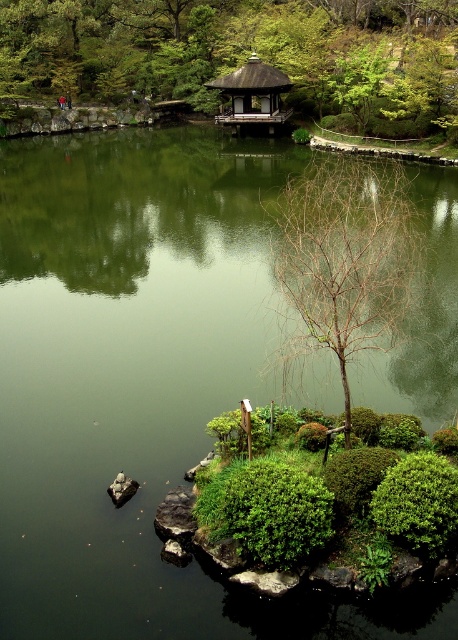
You are a gardener planning to plant a new tree in the Japanese garden. You notice the bare branches at center and the smooth gray rock at lower left. Which object is taller, and how might this affect your planting decision?

The bare branches at center is taller than the smooth gray rock at lower left. When planting a new tree, you should consider the height of the existing bare branches to maintain visual balance and ensure the new tree doesn not overshadow or clash with the existing elements in the garden.

You are a visitor in the garden and want to take a photo of both the green leafy tree at upper center and the shiny dark brown gazebo at upper center. Can you frame both in the same shot without moving your position?

Yes, you can frame both the green leafy tree at upper center and the shiny dark brown gazebo at upper center in the same shot because the green leafy tree at upper center is positioned above the gazebo, allowing both to be captured within the camera frame.

You are a gardener who wants to plant a new tree between the green leafy tree at upper center and the bare branches at center. The new tree needs to be at least 30 meters away from both existing trees to ensure proper growth. Is there enough space between them to plant the new tree?

The distance between the green leafy tree at upper center and the bare branches at center is 26.90 meters. Since the required minimum distance for planting the new tree is 30 meters, there isn not enough space between them to plant the new tree.